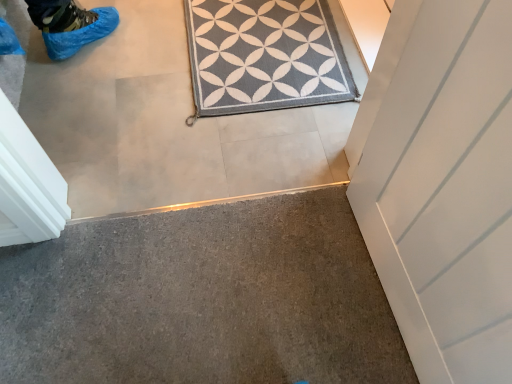
Question: Should I look upward or downward to see gray textured rug at center?

Choices:
 (A) up
 (B) down

Answer: (A)

Question: Is gray carpet at lower left to the right of gray textured rug at center from the viewer's perspective?

Choices:
 (A) no
 (B) yes

Answer: (A)

Question: From a real-world perspective, is gray carpet at lower left under gray textured rug at center?

Choices:
 (A) yes
 (B) no

Answer: (A)

Question: Is gray carpet at lower left at the left side of gray textured rug at center?

Choices:
 (A) no
 (B) yes

Answer: (B)

Question: From the image's perspective, does gray carpet at lower left appear lower than gray textured rug at center?

Choices:
 (A) yes
 (B) no

Answer: (A)

Question: From a real-world perspective, is gray carpet at lower left located higher than gray textured rug at center?

Choices:
 (A) no
 (B) yes

Answer: (A)

Question: Is gray carpet at lower left facing towards gray textured rug at center?

Choices:
 (A) yes
 (B) no

Answer: (A)

Question: Is gray textured rug at center touching gray carpet at lower left?

Choices:
 (A) yes
 (B) no

Answer: (B)

Question: Considering the relative positions of gray textured rug at center and gray carpet at lower left in the image provided, is gray textured rug at center to the left of gray carpet at lower left from the viewer's perspective?

Choices:
 (A) yes
 (B) no

Answer: (B)

Question: From a real-world perspective, is gray textured rug at center located higher than gray carpet at lower left?

Choices:
 (A) no
 (B) yes

Answer: (B)

Question: Is gray textured rug at center shorter than gray carpet at lower left?

Choices:
 (A) yes
 (B) no

Answer: (A)

Question: Considering the relative sizes of gray textured rug at center and gray carpet at lower left in the image provided, is gray textured rug at center smaller than gray carpet at lower left?

Choices:
 (A) no
 (B) yes

Answer: (B)

Question: Is gray textured rug at center oriented away from gray carpet at lower left?

Choices:
 (A) yes
 (B) no

Answer: (B)

Question: Is gray carpet at lower left taller or shorter than gray textured rug at center?

Choices:
 (A) tall
 (B) short

Answer: (A)